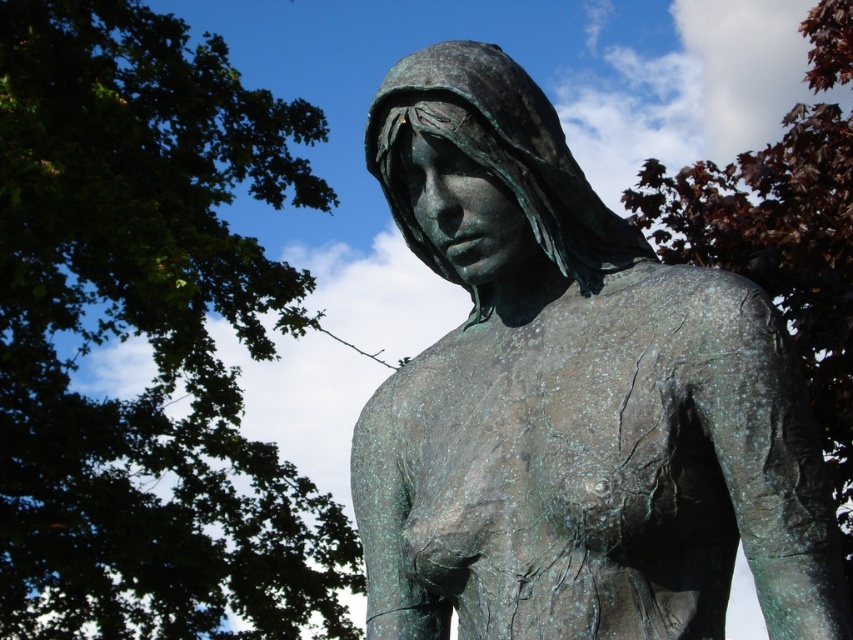
Does green patina statue at center lie in front of green leafy tree at upper left?

Yes, green patina statue at center is closer to the viewer.

Is green patina statue at center below green leafy tree at upper left?

Incorrect, green patina statue at center is not positioned below green leafy tree at upper left.

The width and height of the screenshot is (853, 640). Find the location of `green patina statue at center`. green patina statue at center is located at coordinates (572, 401).

Identify the location of green patina statue at center. (572, 401).

Does green leafy tree at upper left appear on the right side of dark red leaves at upper right?

Incorrect, green leafy tree at upper left is not on the right side of dark red leaves at upper right.

Is point (219, 524) behind point (831, 368)?

Yes, point (219, 524) is behind point (831, 368).

Find the location of `green leafy tree at upper left`. green leafy tree at upper left is located at coordinates (148, 337).

Between green patina statue at center and dark red leaves at upper right, which one appears on the left side from the viewer's perspective?

green patina statue at center is more to the left.

Does green patina statue at center have a greater height compared to dark red leaves at upper right?

Indeed, green patina statue at center has a greater height compared to dark red leaves at upper right.

Between point (462, 420) and point (733, 228), which one is positioned behind?

The point (733, 228) is more distant.

Locate an element on the screen. green patina statue at center is located at coordinates (572, 401).